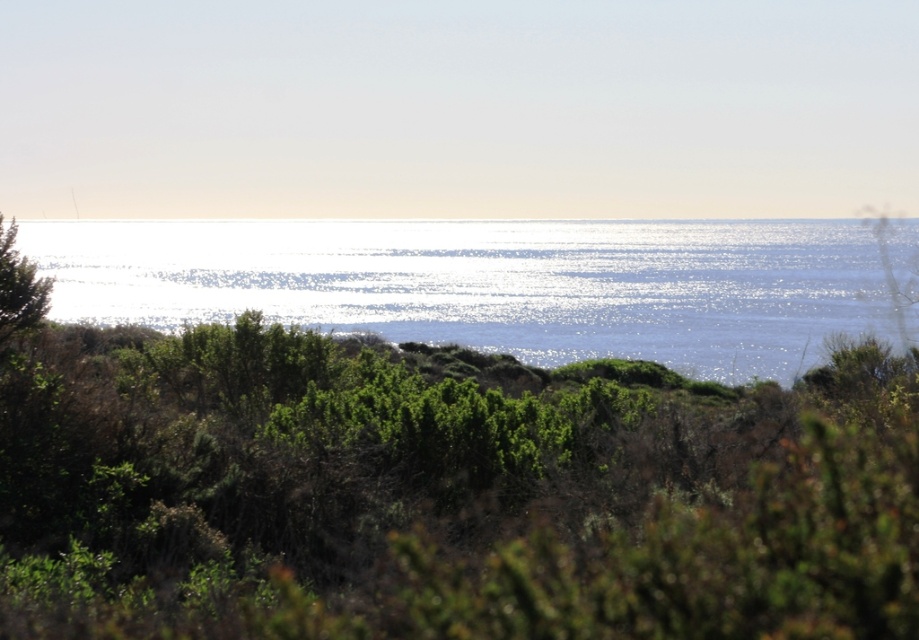
Can you confirm if green leafy bush at upper center is shorter than green leafy tree at left?

No.

Which is in front, point (36, 397) or point (9, 244)?

Point (36, 397) is more forward.

Measure the distance between green leafy bush at upper center and camera.

A distance of 13.95 feet exists between green leafy bush at upper center and camera.

Locate an element on the screen. Image resolution: width=919 pixels, height=640 pixels. green leafy bush at upper center is located at coordinates (444, 493).

At what (x,y) coordinates should I click in order to perform the action: click on glistening blue water at center. Please return your answer as a coordinate pair (x, y). This screenshot has height=640, width=919. Looking at the image, I should click on (491, 284).

Between glistening blue water at center and green leafy tree at left, which one is positioned higher?

Positioned higher is glistening blue water at center.

Find the location of `glistening blue water at center`. glistening blue water at center is located at coordinates (491, 284).

I want to click on glistening blue water at center, so click(491, 284).

Which of these two, green leafy bush at upper center or glistening blue water at center, stands taller?

With more height is glistening blue water at center.

Which is more to the right, green leafy bush at upper center or glistening blue water at center?

Positioned to the right is glistening blue water at center.

Between point (494, 516) and point (106, 310), which one is positioned in front?

Positioned in front is point (494, 516).

Locate an element on the screen. green leafy bush at upper center is located at coordinates (444, 493).